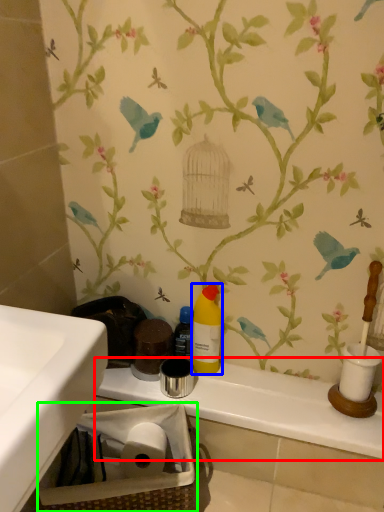
Question: Considering the real-world distances, which object is closest to counter top (highlighted by a red box)? cleaning product (highlighted by a blue box) or basket (highlighted by a green box).

Choices:
 (A) cleaning product
 (B) basket

Answer: (B)